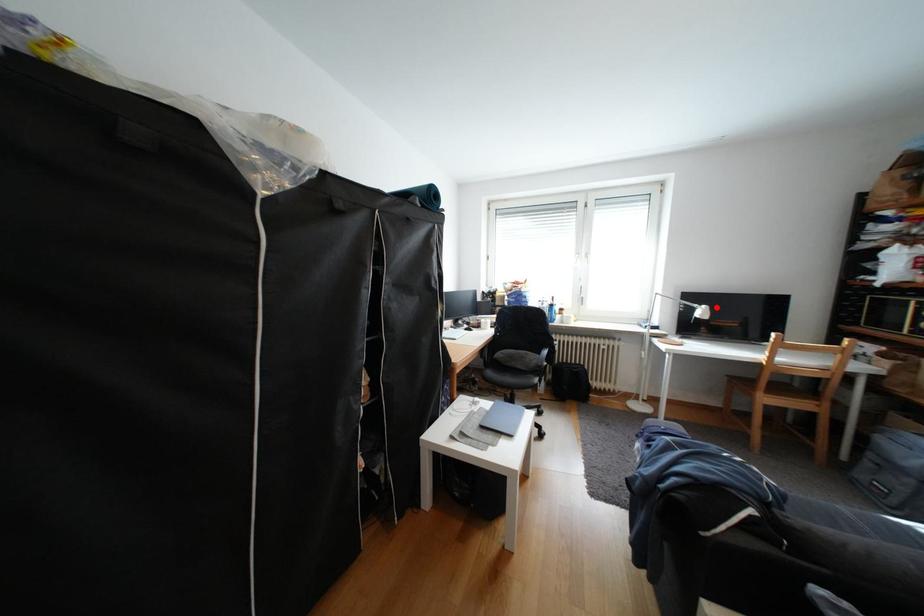
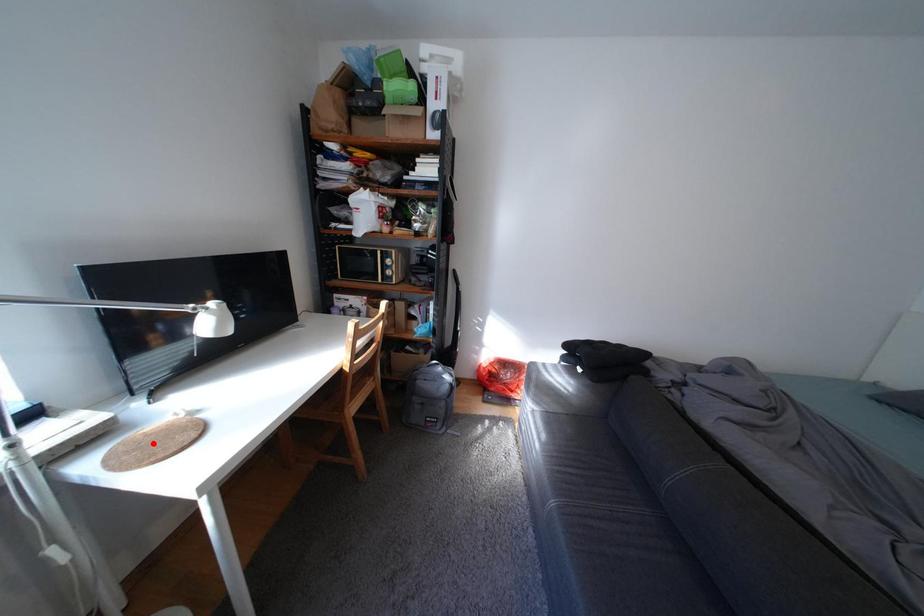
I am providing you with two images of the same scene from different viewpoints. A red point is marked on the first image and another point is marked on the second image. Are the points marked in image1 and image2 representing the same 3D position?

No